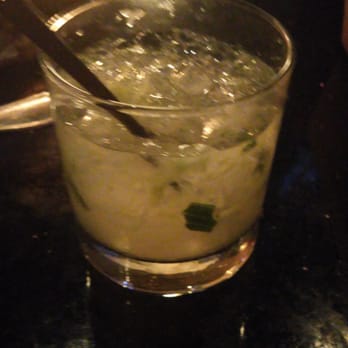
The image size is (348, 348). I want to click on bottom of glass, so click(x=137, y=281).